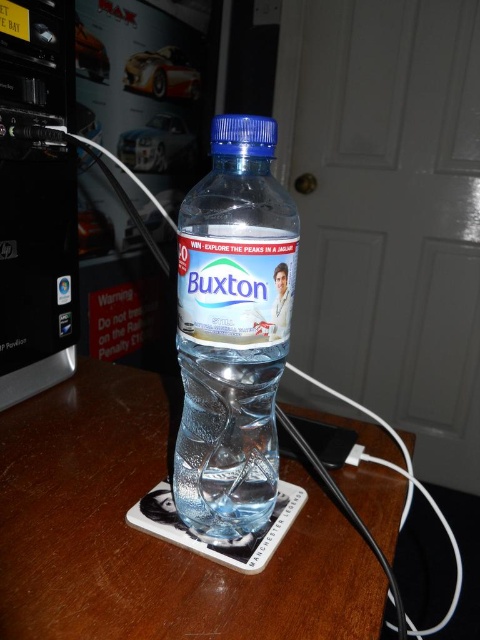
You are arranging items on a table and want to place both the clear wood coaster at center and the clear plastic bottle at center. Based on the scene, where should you place the coaster relative to the bottle?

The clear wood coaster at center is located below the clear plastic bottle at center, so you should place the coaster underneath the bottle to match the scene.

You are standing 25 inches away from the wooden surface where the Buxton water bottle is placed. If you move forward 4 inches toward the surface, will the point at coordinates point [54,497] become closer to you than 20 inches?

The distance of point [54,497] from viewer is 20.81 inches. After moving forward 4 inches, your new distance to the wooden surface is 25 inches minus 4 inches equals 21 inches. Since 21 inches is greater than 20.81 inches, the point at coordinates point [54,497] will be closer than 20 inches.